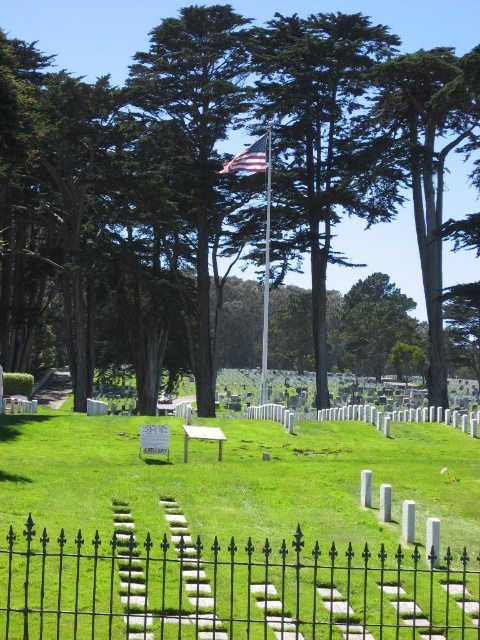
From the picture: You are a groundskeeper planning to replace the green leafy tree at center and the american flag at center with new ones. If you want to ensure the new trees and flag have the same width as the existing ones, which one requires a wider replacement?

The green leafy tree at center requires a wider replacement since its width surpasses that of the american flag at center.

You are a visitor at the cemetery and want to take a photo of the american flag at center while standing behind the black wrought iron fence at lower center. Can you position yourself so that the flag is visible through the fence?

The black wrought iron fence at lower center is to the right of the american flag at center, so if you position yourself to the left side of the fence, you can see the flag through the fence.

You are a landscape architect designing a new cemetery layout. You need to ensure that the green leafy tree at center does not block the view of the american flag at center from the main entrance. Given their heights, is this possible?

The green leafy tree at center is taller than the american flag at center. Since the tree is taller, it could potentially block the view of the flag unless positioned appropriately. However, since both are at the center, adjusting their placement might be necessary to ensure visibility.